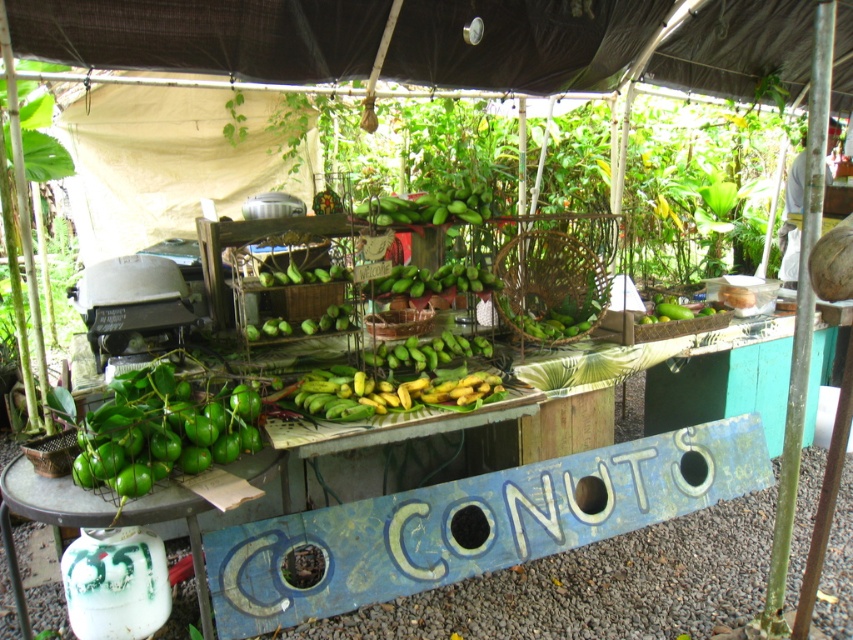
Does green matte limes at lower left come in front of green matte fruit basket at lower left?

No, it is not.

This screenshot has height=640, width=853. In order to click on green matte limes at lower left in this screenshot , I will do `click(160, 433)`.

Where is `green matte limes at lower left`? The height and width of the screenshot is (640, 853). green matte limes at lower left is located at coordinates (160, 433).

Between green matte fruit basket at lower left and green matte mangoes at center, which one has less height?

green matte mangoes at center

Is green matte fruit basket at lower left positioned behind green matte mangoes at center?

No, green matte fruit basket at lower left is closer to the viewer.

You are a GUI agent. You are given a task and a screenshot of the screen. Output one action in this format:
    pyautogui.click(x=<x>, y=<y>)
    Task: Click on the green matte fruit basket at lower left
    
    Given the screenshot: What is the action you would take?
    pyautogui.click(x=42, y=513)

Who is taller, green matte bananas at center or green matte mangoes at center?

Standing taller between the two is green matte mangoes at center.

Who is lower down, green matte bananas at center or green matte mangoes at center?

Positioned lower is green matte bananas at center.

Looking at this image, measure the distance between point [428,342] and camera.

The distance of point [428,342] from camera is 2.77 meters.

The height and width of the screenshot is (640, 853). Identify the location of green matte bananas at center. (428, 352).